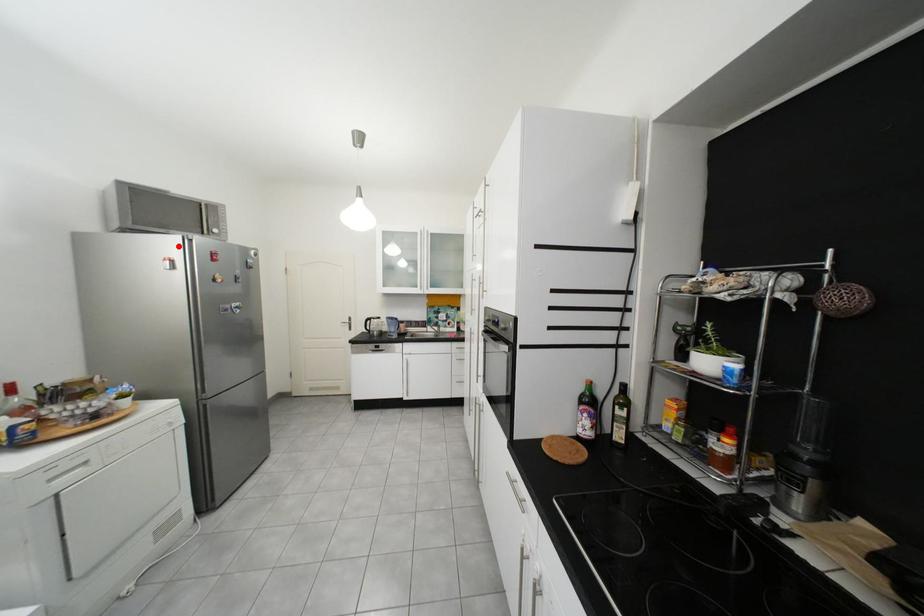
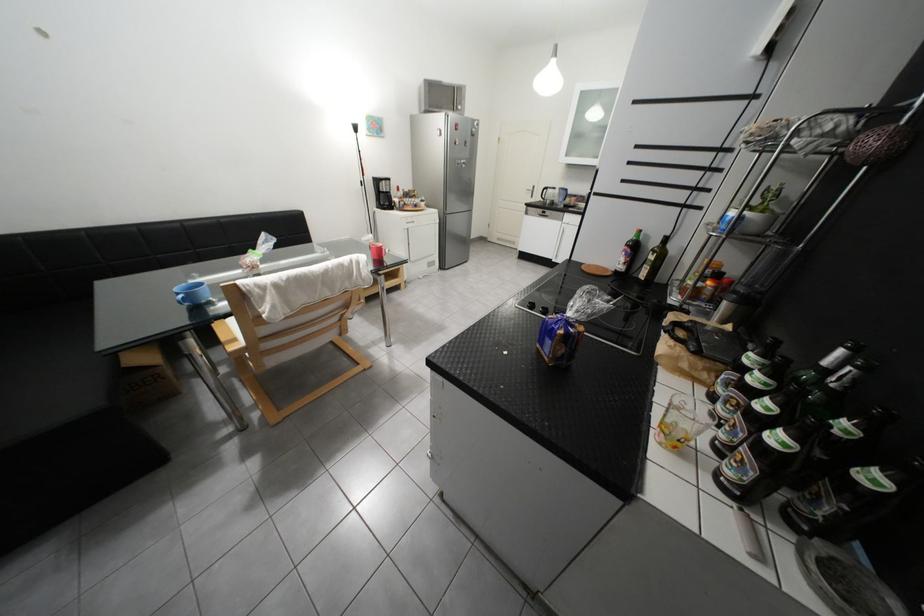
Question: I am providing you with two images of the same scene from different viewpoints. A red point is shown in image1. For the corresponding object point in image2, is it positioned nearer or farther from the camera?

Choices:
 (A) Nearer
 (B) Farther

Answer: (A)